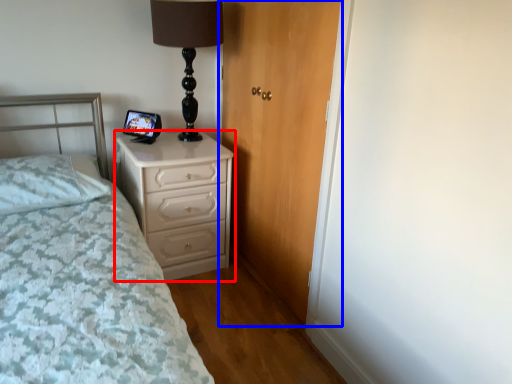
Question: Among these objects, which one is nearest to the camera, chest of drawers (highlighted by a red box) or door (highlighted by a blue box)?

Choices:
 (A) chest of drawers
 (B) door

Answer: (B)